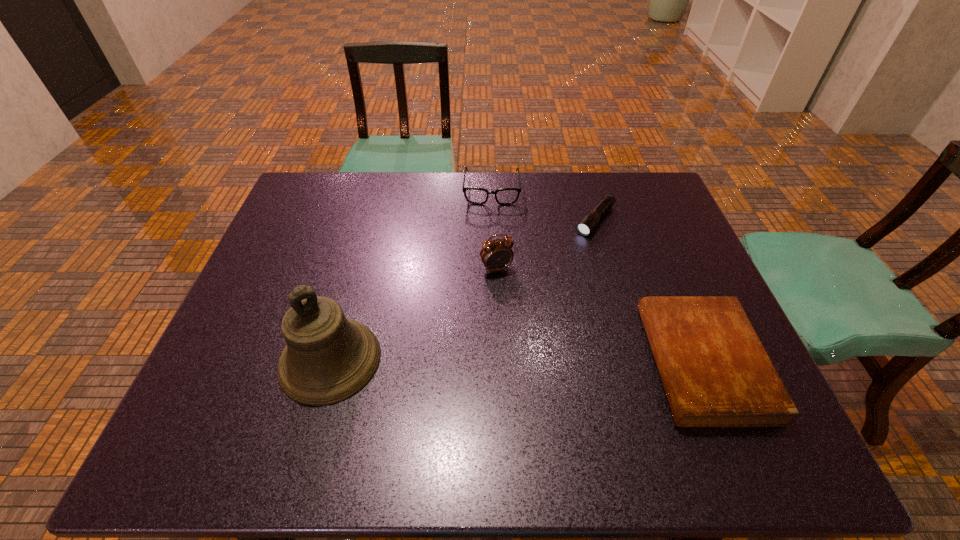
You are a GUI agent. You are given a task and a screenshot of the screen. Output one action in this format:
    pyautogui.click(x=<x>, y=<y>)
    Task: Click on the blank space located on the spine side of the Bible
    
    Given the screenshot: What is the action you would take?
    pyautogui.click(x=599, y=362)

You are a GUI agent. You are given a task and a screenshot of the screen. Output one action in this format:
    pyautogui.click(x=<x>, y=<y>)
    Task: Click on the free space located 0.390m at the lens end of the flashlight
    The image size is (960, 540).
    Given the screenshot: What is the action you would take?
    pyautogui.click(x=514, y=319)

Identify the location of vacant space located 0.310m at the lens end of the flashlight. The height and width of the screenshot is (540, 960). (530, 299).

The image size is (960, 540). Find the location of `free space located 0.370m at the lens end of the flashlight`. free space located 0.370m at the lens end of the flashlight is located at coordinates (517, 314).

You are a GUI agent. You are given a task and a screenshot of the screen. Output one action in this format:
    pyautogui.click(x=<x>, y=<y>)
    Task: Click on the free space located on the front-facing side of the spectacles
    This screenshot has height=540, width=960.
    Given the screenshot: What is the action you would take?
    pyautogui.click(x=491, y=293)

Where is `blank space located on the front-facing side of the spectacles`? This screenshot has width=960, height=540. blank space located on the front-facing side of the spectacles is located at coordinates (491, 279).

This screenshot has width=960, height=540. I want to click on vacant area located 0.240m on the front-facing side of the spectacles, so click(491, 258).

Image resolution: width=960 pixels, height=540 pixels. In order to click on free spot located 0.140m on the face of the third nearest object in this screenshot , I will do `click(522, 314)`.

This screenshot has height=540, width=960. What are the coordinates of `vacant area situated 0.210m on the face of the third nearest object` in the screenshot? It's located at (535, 336).

Locate an element on the screen. free location located on the face of the third nearest object is located at coordinates (521, 312).